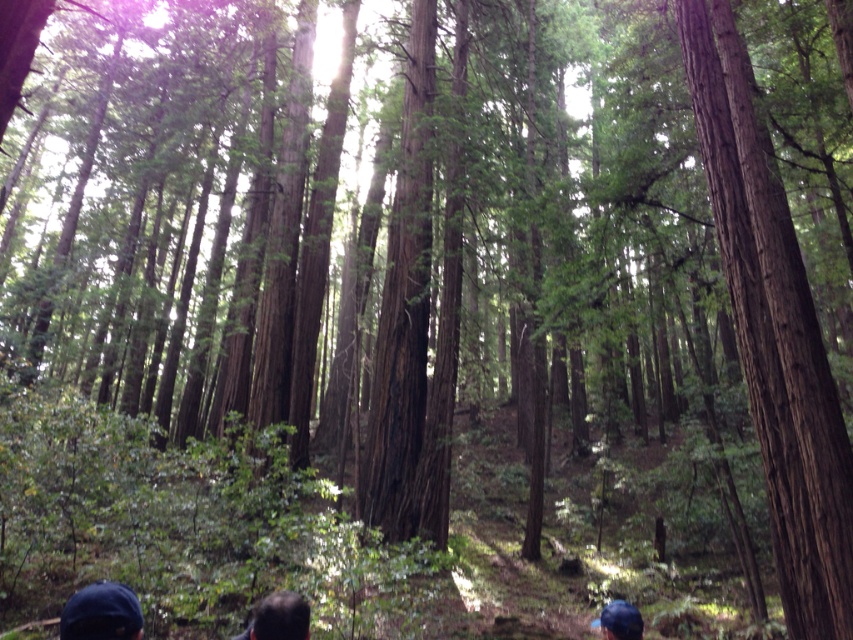
Question: Considering the relative positions of dark brown hair at lower center and blue fabric cap at lower center in the image provided, where is dark brown hair at lower center located with respect to blue fabric cap at lower center?

Choices:
 (A) right
 (B) left

Answer: (B)

Question: Where is smooth brown tree trunk at center located in relation to dark brown hair at lower center in the image?

Choices:
 (A) left
 (B) right

Answer: (B)

Question: Based on their relative distances, which object is farther from the blue fabric cap at lower center?

Choices:
 (A) dark brown hair at lower center
 (B) dark blue fabric cap at lower left
 (C) smooth brown tree trunk at center

Answer: (C)

Question: Can you confirm if dark brown hair at lower center is bigger than blue fabric cap at lower center?

Choices:
 (A) yes
 (B) no

Answer: (B)

Question: Which object is the closest to the smooth brown tree trunk at center?

Choices:
 (A) dark brown hair at lower center
 (B) dark blue fabric cap at lower left
 (C) blue fabric cap at lower center

Answer: (C)

Question: Which object is closer to the camera taking this photo?

Choices:
 (A) smooth brown tree trunk at center
 (B) dark blue fabric cap at lower left
 (C) dark brown hair at lower center
 (D) blue fabric cap at lower center

Answer: (B)